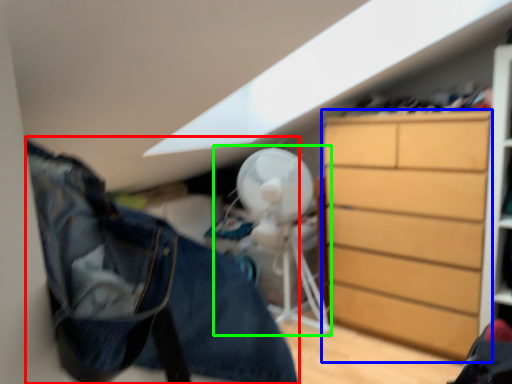
Question: Estimate the real-world distances between objects in this image. Which object is closer to clothing (highlighted by a red box), chest of drawers (highlighted by a blue box) or mechanical fan (highlighted by a green box)?

Choices:
 (A) chest of drawers
 (B) mechanical fan

Answer: (A)